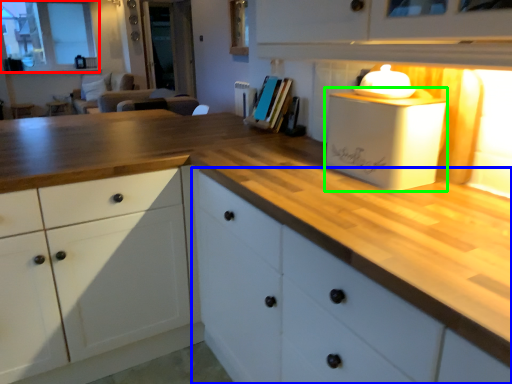
Question: Considering the real-world distances, which object is closest to window (highlighted by a red box)? cabinetry (highlighted by a blue box) or appliance (highlighted by a green box).

Choices:
 (A) cabinetry
 (B) appliance

Answer: (A)